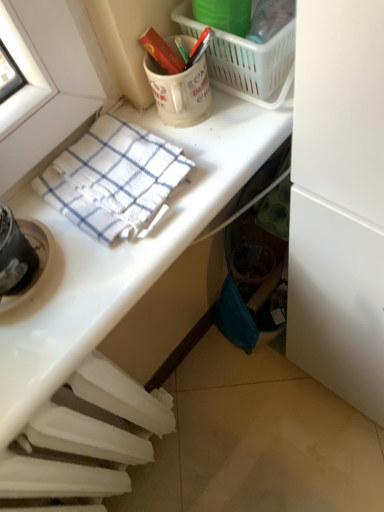
Identify the location of free point to the left of white matte coffee cup at upper center. (125, 121).